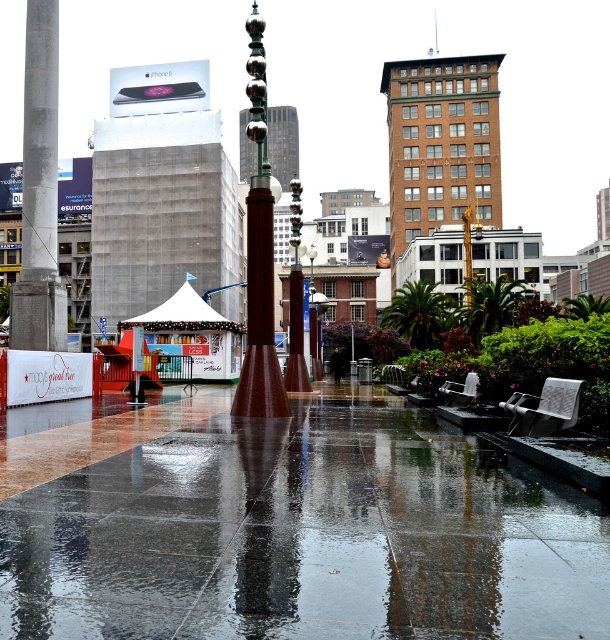
You are standing in the plaza and want to take a photo of the metallic pole at center without any reflections from the glossy concrete pavement at center. Since the pavement is wet and reflective, where should you position yourself relative to the pole to avoid the reflection?

To avoid the reflection from the glossy concrete pavement at center, you should position yourself to the side of the metallic pole at center, not directly in front of it. This way, the angle of the sunlight or artificial light will not reflect the pole onto the pavement.

You are a delivery person carrying a large box that needs to be placed on a surface. Given the scene described, which object, the glossy concrete pavement at center or the metallic pole at center, would be more suitable for placing the box?

The glossy concrete pavement at center has a lesser height compared to the metallic pole at center, so the glossy concrete pavement at center would be more suitable for placing the large box as it is lower and provides a stable surface.

You are standing in the plaza and want to take a photo of the brown brick building at upper center and the polished bronze pole at center. Which object should you focus on first to ensure both are in the frame?

You should focus on the polished bronze pole at center first because the brown brick building at upper center is further away, so adjusting focus starting from the closer object will help capture both in the frame.